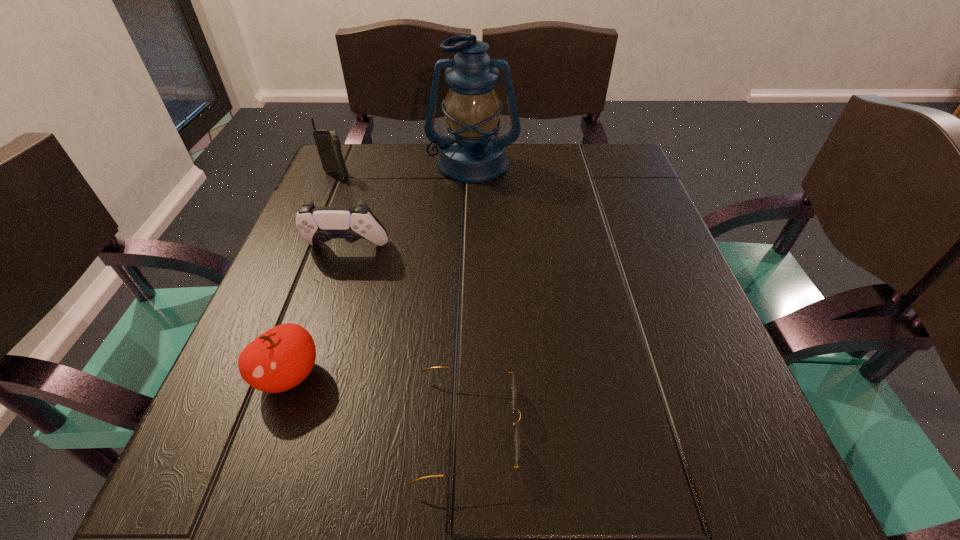
Locate an element on the screen. The image size is (960, 540). lantern situated at the far edge is located at coordinates (473, 154).

Where is `cellular telephone present at the far edge`? This screenshot has width=960, height=540. cellular telephone present at the far edge is located at coordinates (328, 144).

Identify the location of object that is at the near edge. (516, 435).

Where is `cellular telephone located at the left edge`? cellular telephone located at the left edge is located at coordinates (328, 144).

You are a GUI agent. You are given a task and a screenshot of the screen. Output one action in this format:
    pyautogui.click(x=<x>, y=<y>)
    Task: Click on the control that is at the left edge
    The image size is (960, 540).
    Given the screenshot: What is the action you would take?
    pyautogui.click(x=315, y=224)

Where is `apple that is at the left edge`? apple that is at the left edge is located at coordinates (281, 358).

You are a GUI agent. You are given a task and a screenshot of the screen. Output one action in this format:
    pyautogui.click(x=<x>, y=<y>)
    Task: Click on the object present at the far left corner
    
    Given the screenshot: What is the action you would take?
    [328, 144]

Identify the location of vacant space at the far edge of the desktop. This screenshot has width=960, height=540. (563, 186).

This screenshot has height=540, width=960. In the image, there is a desktop. What are the coordinates of `vacant space at the near edge` in the screenshot? It's located at click(547, 500).

The height and width of the screenshot is (540, 960). What are the coordinates of `vacant position at the left edge of the desktop` in the screenshot? It's located at (282, 289).